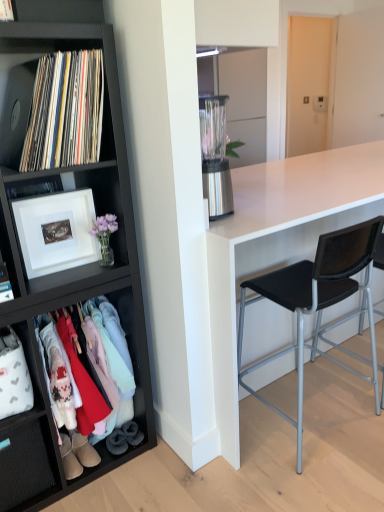
This screenshot has height=512, width=384. In order to click on free space in front of velvet grey boot at lower left, the 1th shoe from the left in this screenshot , I will do `click(97, 481)`.